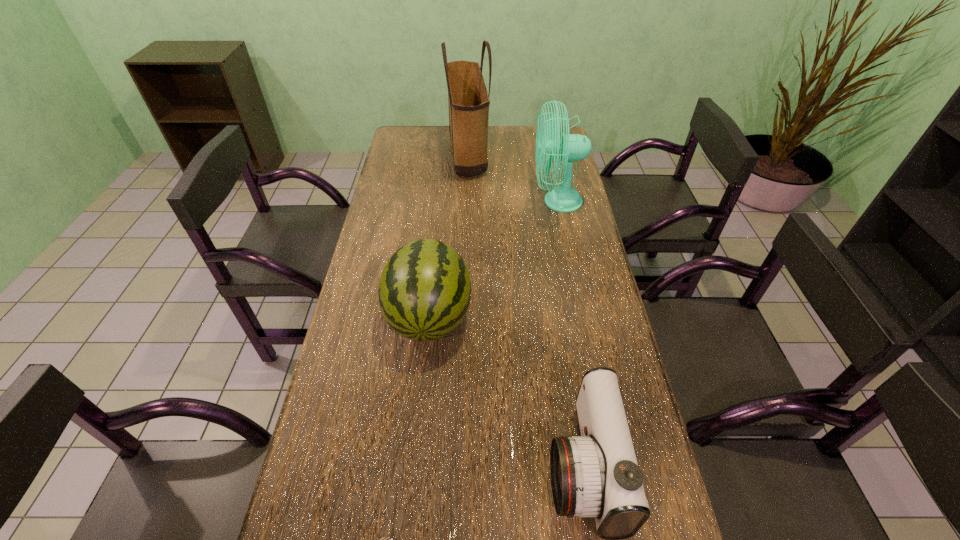
At what (x,y) coordinates should I click in order to perform the action: click on the tallest object. Please return your answer as a coordinate pair (x, y). Looking at the image, I should click on (468, 99).

I want to click on fan, so click(x=568, y=147).

Identify the location of watermelon. (424, 293).

You are a GUI agent. You are given a task and a screenshot of the screen. Output one action in this format:
    pyautogui.click(x=<x>, y=<y>)
    Task: Click on the third tallest object
    The height and width of the screenshot is (540, 960).
    Given the screenshot: What is the action you would take?
    pyautogui.click(x=424, y=293)

Where is `vacant area located on the back of the tote bag`? This screenshot has height=540, width=960. vacant area located on the back of the tote bag is located at coordinates (469, 126).

I want to click on vacant space situated in front of the fan to blow air, so click(x=471, y=201).

You are a GUI agent. You are given a task and a screenshot of the screen. Output one action in this format:
    pyautogui.click(x=<x>, y=<y>)
    Task: Click on the free spot located 0.230m in front of the fan to blow air
    
    Given the screenshot: What is the action you would take?
    pyautogui.click(x=469, y=201)

You are a GUI agent. You are given a task and a screenshot of the screen. Output one action in this format:
    pyautogui.click(x=<x>, y=<y>)
    Task: Click on the free location located 0.160m in front of the fan to blow air
    
    Given the screenshot: What is the action you would take?
    pyautogui.click(x=489, y=201)

Identify the location of vacant position located at the stem end of the third nearest object. This screenshot has height=540, width=960. (408, 525).

I want to click on object that is at the far edge, so click(468, 99).